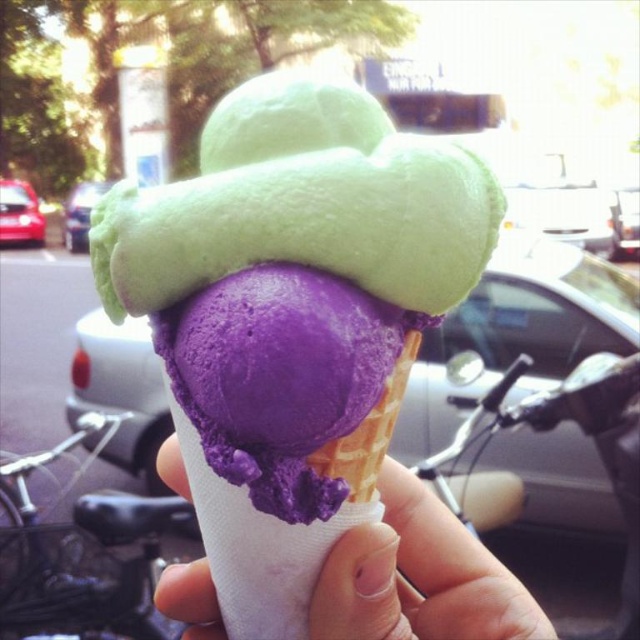
Is point (246, 260) behind point (404, 611)?

That is False.

Consider the image. Who is more distant from viewer, (326,202) or (371,627)?

The point (371,627) is behind.

Who is more forward, [225,566] or [461,532]?

Point [225,566] is more forward.

Find the location of a particular element. The width and height of the screenshot is (640, 640). purple matte ice cream at center is located at coordinates (291, 316).